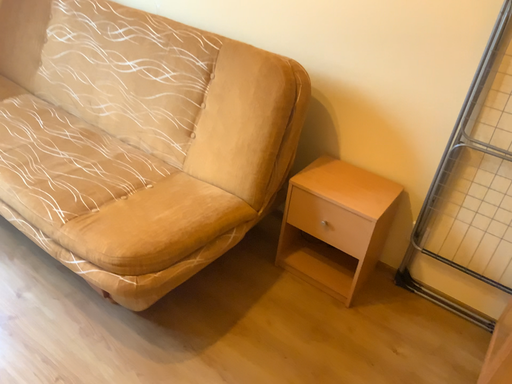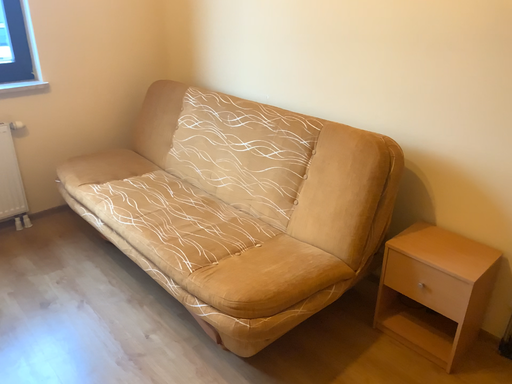
Question: How did the camera likely rotate when shooting the video?

Choices:
 (A) rotated right
 (B) rotated left

Answer: (B)